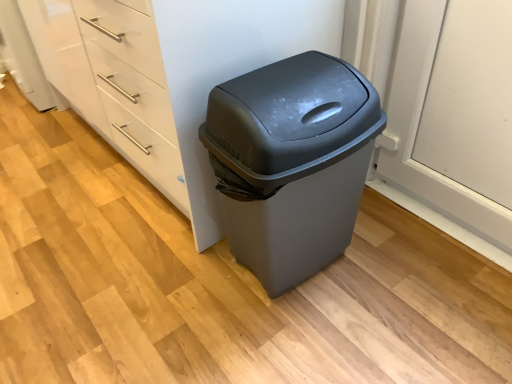
The height and width of the screenshot is (384, 512). I want to click on vacant space situated on the left part of matte gray plastic trash can at center, so click(x=184, y=285).